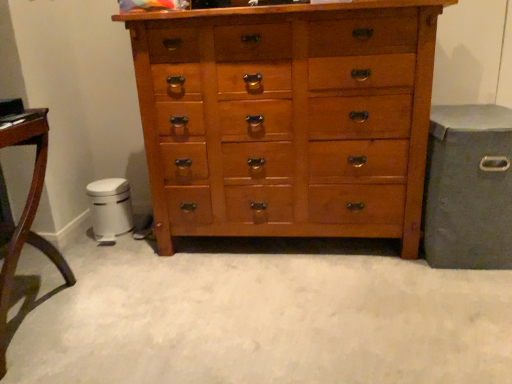
Question: Does matte gray storage bin at right have a larger size compared to brushed metal trash can at lower left?

Choices:
 (A) no
 (B) yes

Answer: (B)

Question: Would you say matte gray storage bin at right is outside brushed metal trash can at lower left?

Choices:
 (A) yes
 (B) no

Answer: (A)

Question: Is matte gray storage bin at right facing towards brushed metal trash can at lower left?

Choices:
 (A) yes
 (B) no

Answer: (B)

Question: From the image's perspective, is matte gray storage bin at right located beneath brushed metal trash can at lower left?

Choices:
 (A) no
 (B) yes

Answer: (A)

Question: Does matte gray storage bin at right have a greater height compared to brushed metal trash can at lower left?

Choices:
 (A) yes
 (B) no

Answer: (A)

Question: Is matte gray storage bin at right closer to camera compared to brushed metal trash can at lower left?

Choices:
 (A) no
 (B) yes

Answer: (B)

Question: Considering the relative sizes of brushed metal trash can at lower left and matte gray storage bin at right in the image provided, is brushed metal trash can at lower left smaller than matte gray storage bin at right?

Choices:
 (A) no
 (B) yes

Answer: (B)

Question: From the image's perspective, does brushed metal trash can at lower left appear higher than matte gray storage bin at right?

Choices:
 (A) no
 (B) yes

Answer: (A)

Question: Is brushed metal trash can at lower left positioned far away from matte gray storage bin at right?

Choices:
 (A) yes
 (B) no

Answer: (A)

Question: From a real-world perspective, is brushed metal trash can at lower left over matte gray storage bin at right?

Choices:
 (A) yes
 (B) no

Answer: (B)

Question: Can you confirm if brushed metal trash can at lower left is shorter than matte gray storage bin at right?

Choices:
 (A) yes
 (B) no

Answer: (A)

Question: From a real-world perspective, is brushed metal trash can at lower left located beneath matte gray storage bin at right?

Choices:
 (A) yes
 (B) no

Answer: (A)

Question: Is wooden chest of drawers at center turned away from brushed metal trash can at lower left?

Choices:
 (A) no
 (B) yes

Answer: (A)